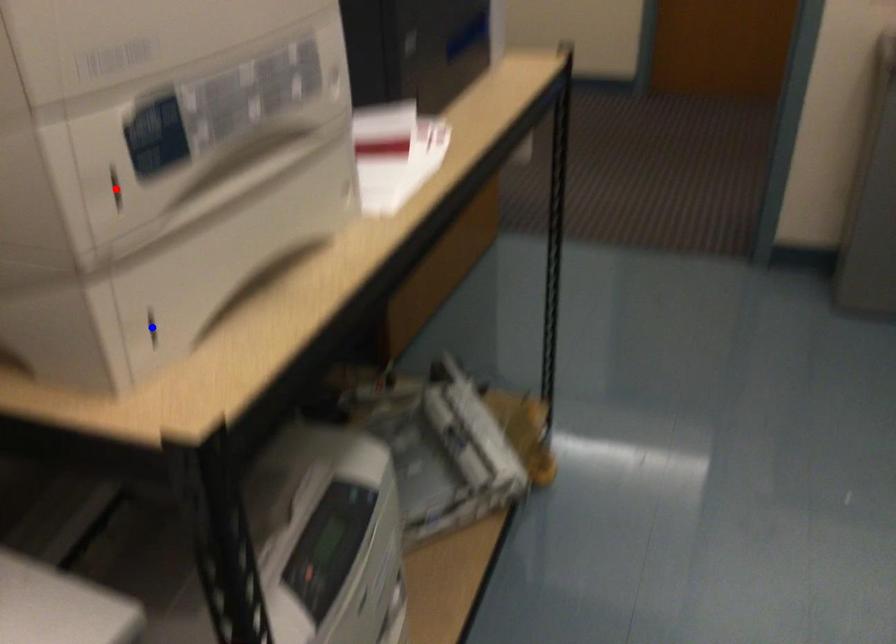
Question: Which of the two points in the image is closer to the camera?

Choices:
 (A) Blue point is closer.
 (B) Red point is closer.

Answer: (B)